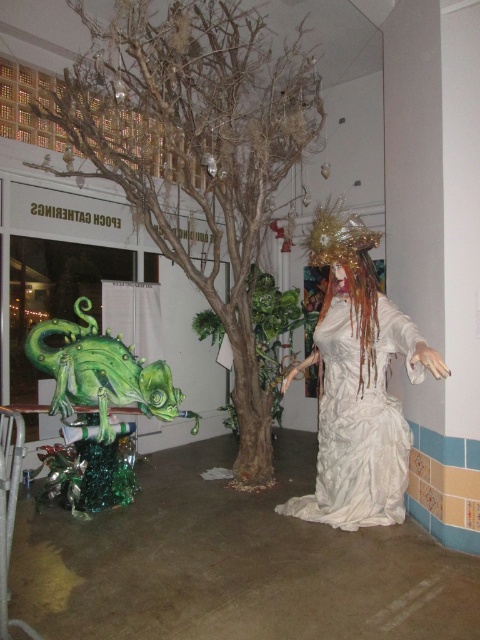
You are standing in the art exhibit and want to take a photo of the green metallic tree at center with your smartphone camera. If your phone has a maximum focus distance of 3 meters, will you be able to capture the tree clearly without moving closer?

The green metallic tree at center is 3.27 meters away from the camera. Since the maximum focus distance is 3 meters, the tree is slightly out of range. You will need to move closer to ensure it is in focus.

Consider the image. You are a guest at this event and want to take a photo of the white textured dress at center. Where should you stand to capture it in the best possible angle?

The white textured dress at center is positioned at point 0.661 on the x axis and 0.750 on the y axis. To capture it in the best angle, you should stand directly in front of it, aligning your camera with the coordinates provided.

You are standing in front of the art exhibit and want to take a photo. There are two points of interest marked as point 1 at coordinates (233,461) and point 2 at (367,394). Which point should you focus on first if you want to capture both in a single frame without moving your camera?

Point 1 at coordinates (233,461) is closer to the camera than point 2 at (367,394). Therefore, focusing on point 1 first will ensure both points are in focus when taking the photo.